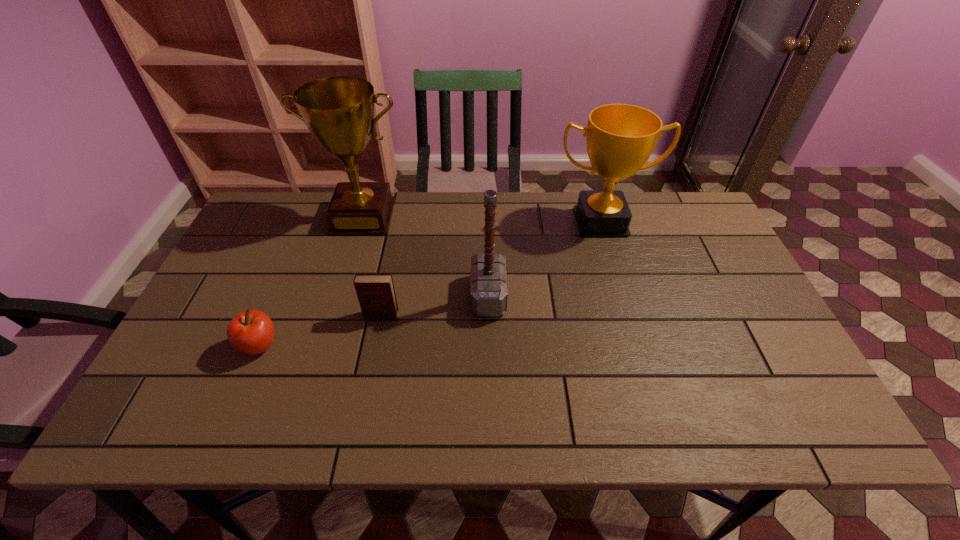
The image size is (960, 540). Find the location of `the third closest object to the apple`. the third closest object to the apple is located at coordinates (489, 289).

At what (x,y) coordinates should I click in order to perform the action: click on object that is the third closest to the hammer. Please return your answer as a coordinate pair (x, y). The image size is (960, 540). Looking at the image, I should click on (339, 111).

Locate an element on the screen. Image resolution: width=960 pixels, height=540 pixels. free space that satisfies the following two spatial constraints: 1. on the front-facing side of the shorter award; 2. on the striking surface of the second object from right to left is located at coordinates (623, 296).

Locate an element on the screen. This screenshot has height=540, width=960. vacant position in the image that satisfies the following two spatial constraints: 1. on the striking surface of the hammer; 2. on the front side of the nearest object is located at coordinates (490, 347).